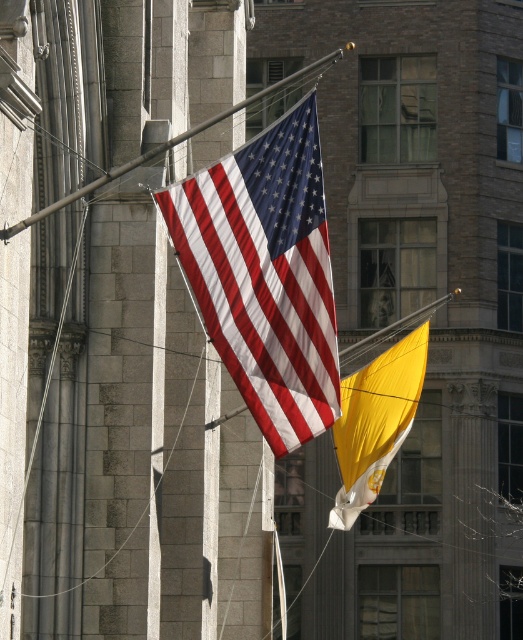
Question: Is matte fabric flag at center further to camera compared to yellow satin flag at center?

Choices:
 (A) yes
 (B) no

Answer: (B)

Question: Which point is farther to the camera?

Choices:
 (A) yellow satin flag at center
 (B) matte fabric flag at center

Answer: (A)

Question: Among these points, which one is nearest to the camera?

Choices:
 (A) (173, 195)
 (B) (410, 387)

Answer: (A)

Question: Does matte fabric flag at center appear under yellow satin flag at center?

Choices:
 (A) no
 (B) yes

Answer: (A)

Question: Can you confirm if matte fabric flag at center is positioned below yellow satin flag at center?

Choices:
 (A) yes
 (B) no

Answer: (B)